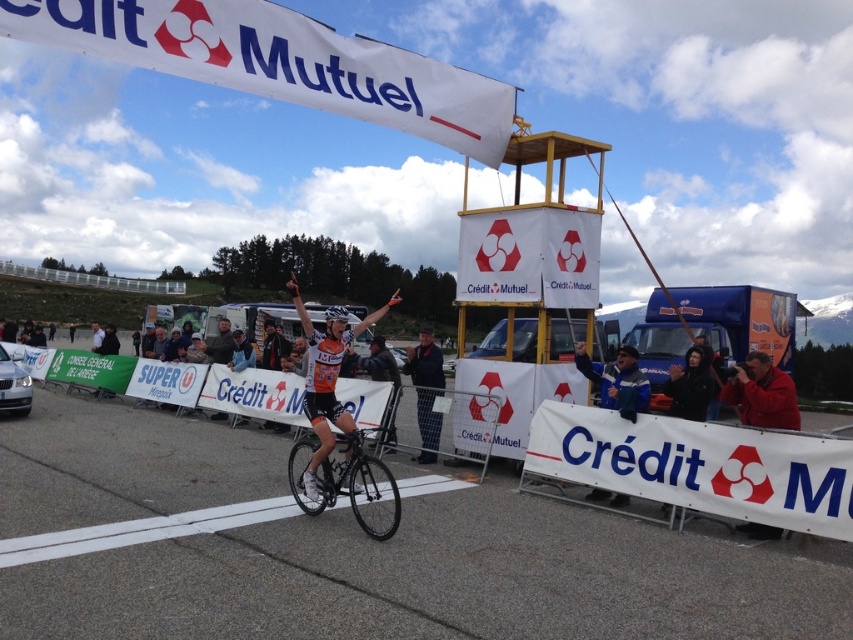
Who is more distant from viewer, (305,493) or (357,518)?

Positioned behind is point (305,493).

Is orange jersey cyclist at center bigger than shiny black bicycle at center?

Correct, orange jersey cyclist at center is larger in size than shiny black bicycle at center.

Where is `orange jersey cyclist at center`? orange jersey cyclist at center is located at coordinates (334, 417).

Locate an element on the screen. The width and height of the screenshot is (853, 640). orange jersey cyclist at center is located at coordinates (334, 417).

Is point (312, 508) farther from camera compared to point (585, 497)?

No, (312, 508) is in front of (585, 497).

Locate an element on the screen. This screenshot has height=640, width=853. shiny black bicycle at center is located at coordinates (344, 481).

From the picture: Who is more forward, [399,516] or [706,355]?

Point [399,516] is more forward.

Is shiny black bicycle at center to the left of black leather jacket at upper center from the viewer's perspective?

Correct, you'll find shiny black bicycle at center to the left of black leather jacket at upper center.

Does point (343, 468) come behind point (688, 376)?

No, it is not.

What are the coordinates of `shiny black bicycle at center` in the screenshot? It's located at (344, 481).